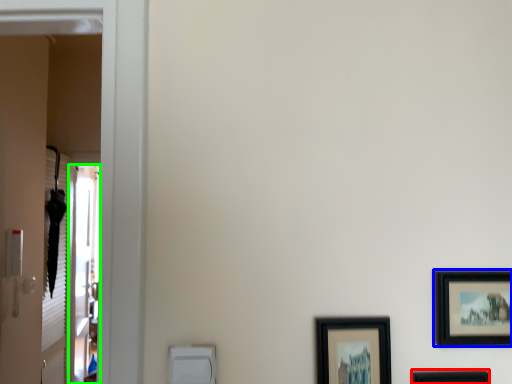
Question: Based on their relative distances, which object is farther from picture frame (highlighted by a red box)? Choose from picture frame (highlighted by a blue box) and screen door (highlighted by a green box).

Choices:
 (A) picture frame
 (B) screen door

Answer: (B)